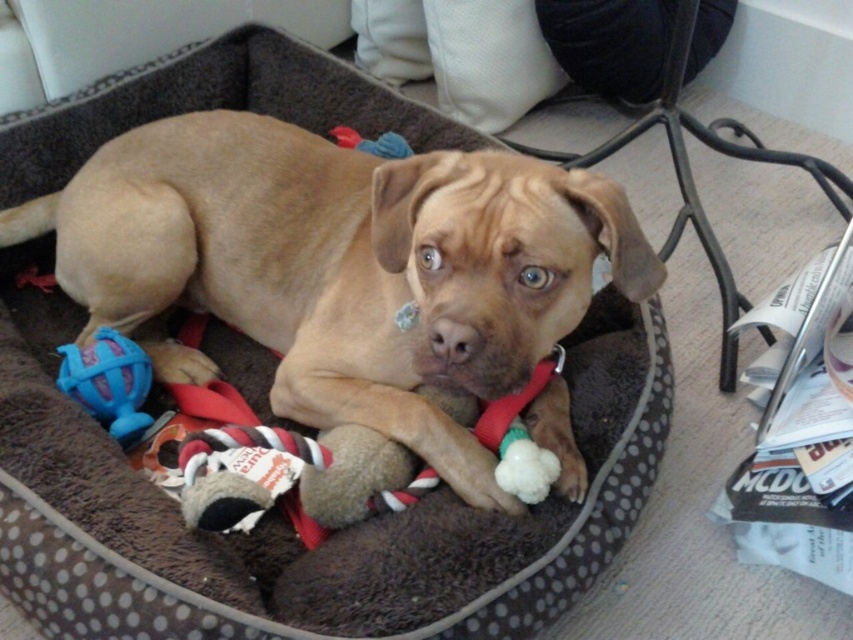
Looking at this image, does brown fur dog at center appear under blue rubber ball at lower left?

Actually, brown fur dog at center is above blue rubber ball at lower left.

Can you confirm if brown fur dog at center is wider than blue rubber ball at lower left?

Yes.

Identify the location of brown fur dog at center. (341, 268).